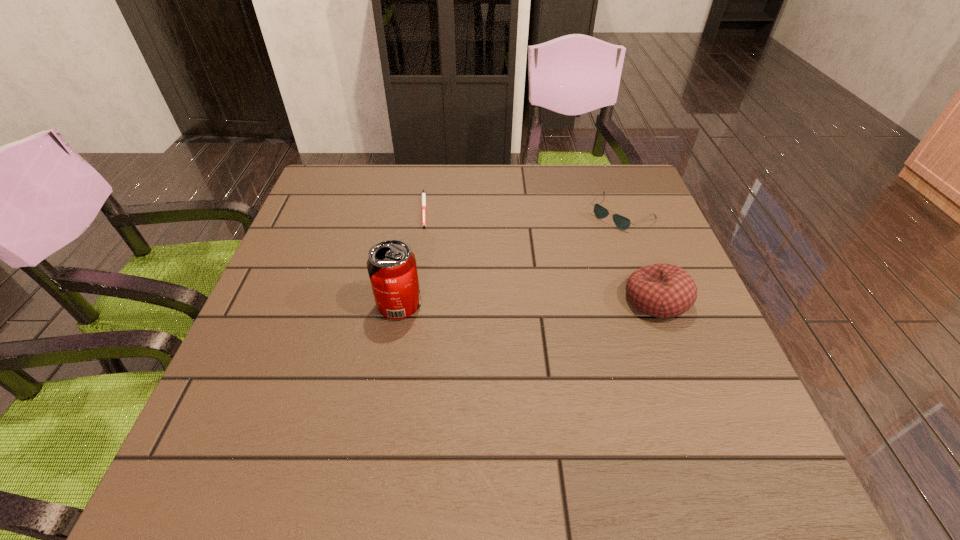
The image size is (960, 540). Find the location of `vacant area between the beanbag and the soda can`. vacant area between the beanbag and the soda can is located at coordinates (528, 302).

Identify the location of object that is the third closest to the pen. This screenshot has height=540, width=960. (660, 290).

Locate an element on the screen. the second closest object relative to the second shortest object is located at coordinates (423, 193).

You are a GUI agent. You are given a task and a screenshot of the screen. Output one action in this format:
    pyautogui.click(x=<x>, y=<y>)
    Task: Click on the free space that satisfies the following two spatial constraints: 1. on the back side of the soda can; 2. on the left side of the sunglasses
    Image resolution: width=960 pixels, height=540 pixels.
    Given the screenshot: What is the action you would take?
    pyautogui.click(x=415, y=214)